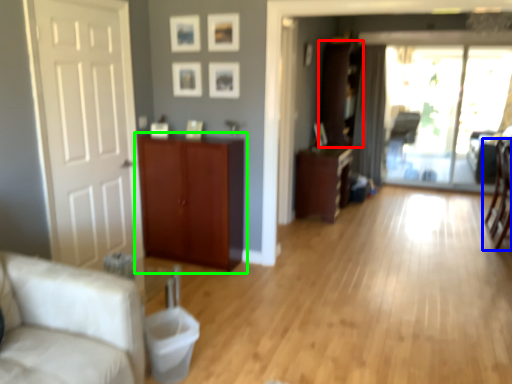
Question: Which object is positioned closest to cabinetry (highlighted by a red box)? Select from chair (highlighted by a blue box) and cabinetry (highlighted by a green box).

Choices:
 (A) chair
 (B) cabinetry

Answer: (A)